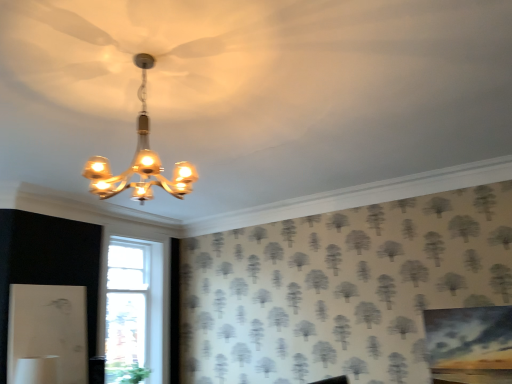
Question: Is green leafy plant at lower left to the left of matte gold chandelier at upper center from the viewer's perspective?

Choices:
 (A) no
 (B) yes

Answer: (B)

Question: Is green leafy plant at lower left bigger than matte gold chandelier at upper center?

Choices:
 (A) no
 (B) yes

Answer: (A)

Question: Does green leafy plant at lower left have a greater width compared to matte gold chandelier at upper center?

Choices:
 (A) no
 (B) yes

Answer: (A)

Question: Considering the relative positions of green leafy plant at lower left and matte gold chandelier at upper center in the image provided, is green leafy plant at lower left to the right of matte gold chandelier at upper center from the viewer's perspective?

Choices:
 (A) yes
 (B) no

Answer: (B)

Question: Can we say green leafy plant at lower left lies outside matte gold chandelier at upper center?

Choices:
 (A) no
 (B) yes

Answer: (B)

Question: Can you confirm if green leafy plant at lower left is shorter than matte gold chandelier at upper center?

Choices:
 (A) yes
 (B) no

Answer: (A)

Question: Considering the relative positions of matte gold chandelier at upper center and green leafy plant at lower left in the image provided, is matte gold chandelier at upper center to the right of green leafy plant at lower left from the viewer's perspective?

Choices:
 (A) no
 (B) yes

Answer: (B)

Question: Is green leafy plant at lower left inside matte gold chandelier at upper center?

Choices:
 (A) yes
 (B) no

Answer: (B)

Question: Are matte gold chandelier at upper center and green leafy plant at lower left making contact?

Choices:
 (A) yes
 (B) no

Answer: (B)

Question: Considering the relative sizes of matte gold chandelier at upper center and green leafy plant at lower left in the image provided, is matte gold chandelier at upper center thinner than green leafy plant at lower left?

Choices:
 (A) yes
 (B) no

Answer: (B)

Question: Is the depth of matte gold chandelier at upper center less than that of green leafy plant at lower left?

Choices:
 (A) no
 (B) yes

Answer: (B)

Question: Is matte gold chandelier at upper center shorter than green leafy plant at lower left?

Choices:
 (A) no
 (B) yes

Answer: (A)

Question: Considering the positions of matte gold chandelier at upper center and green leafy plant at lower left in the image, is matte gold chandelier at upper center taller or shorter than green leafy plant at lower left?

Choices:
 (A) tall
 (B) short

Answer: (A)